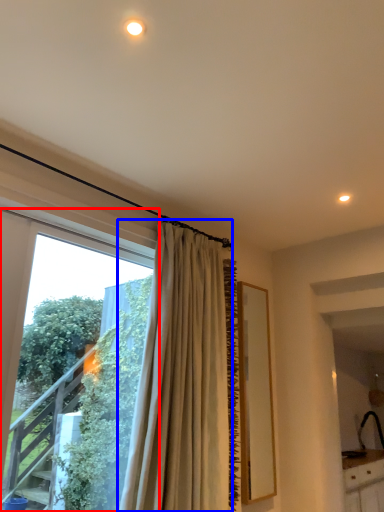
Question: Which object appears closest to the camera in this image, window (highlighted by a red box) or curtain (highlighted by a blue box)?

Choices:
 (A) window
 (B) curtain

Answer: (A)